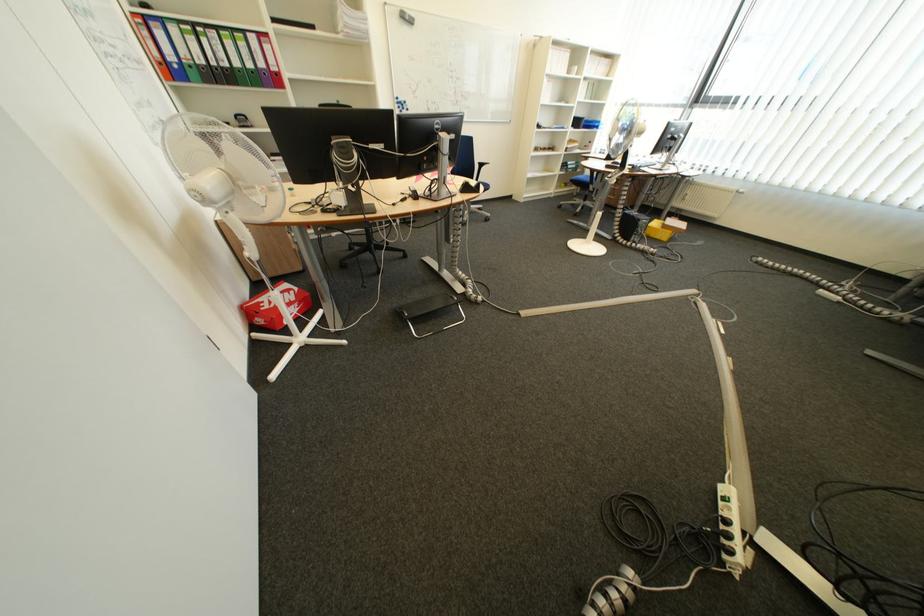
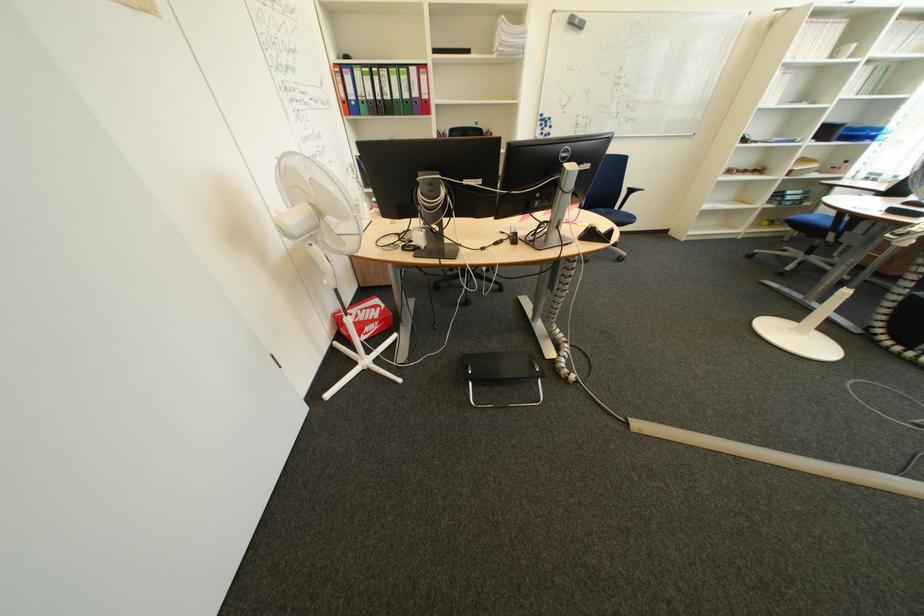
Question: I am providing you with two images of the same scene from different viewpoints. Which of the following objects are not visible in image2?

Choices:
 (A) red shoe box
 (B) blue binder finger hole
 (C) whiteboard eraser
 (D) none of these

Answer: (D)